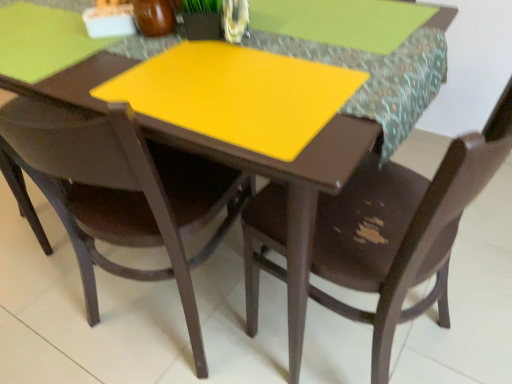
Question: From a real-world perspective, is matte brown chair at center, arranged as the first chair when viewed from the left, positioned over yellow matte placemat at center based on gravity?

Choices:
 (A) yes
 (B) no

Answer: (B)

Question: Is matte brown chair at center, arranged as the first chair when viewed from the left, closer to the viewer compared to yellow matte placemat at center?

Choices:
 (A) yes
 (B) no

Answer: (A)

Question: From the image's perspective, is matte brown chair at center, the second chair viewed from the right, below yellow matte placemat at center?

Choices:
 (A) no
 (B) yes

Answer: (B)

Question: Does matte brown chair at center, the second chair viewed from the right, have a greater width compared to yellow matte placemat at center?

Choices:
 (A) no
 (B) yes

Answer: (B)

Question: Does matte brown chair at center, arranged as the first chair when viewed from the left, have a greater height compared to yellow matte placemat at center?

Choices:
 (A) yes
 (B) no

Answer: (A)

Question: Is yellow matte placemat at center to the left or to the right of matte brown chair at center, arranged as the first chair when viewed from the left, in the image?

Choices:
 (A) left
 (B) right

Answer: (B)

Question: Is yellow matte placemat at center taller or shorter than matte brown chair at center, arranged as the first chair when viewed from the left?

Choices:
 (A) short
 (B) tall

Answer: (A)

Question: Do you think yellow matte placemat at center is within matte brown chair at center, the second chair viewed from the right, or outside of it?

Choices:
 (A) outside
 (B) inside

Answer: (A)

Question: Is yellow matte placemat at center in front of or behind matte brown chair at center, arranged as the first chair when viewed from the left, in the image?

Choices:
 (A) behind
 (B) front

Answer: (A)

Question: From a real-world perspective, relative to yellow matte placemat at center, is brown matte chair at center, acting as the 2th chair starting from the left, vertically above or below?

Choices:
 (A) below
 (B) above

Answer: (A)

Question: Is point (349, 269) closer or farther from the camera than point (371, 82)?

Choices:
 (A) farther
 (B) closer

Answer: (A)

Question: From the image's perspective, is brown matte chair at center, which is counted as the first chair, starting from the right, positioned above or below yellow matte placemat at center?

Choices:
 (A) above
 (B) below

Answer: (B)

Question: Relative to yellow matte placemat at center, is brown matte chair at center, which is counted as the first chair, starting from the right, in front or behind?

Choices:
 (A) behind
 (B) front

Answer: (B)

Question: In the image, is matte brown chair at center, the second chair viewed from the right, positioned in front of or behind brown matte chair at center, acting as the 2th chair starting from the left?

Choices:
 (A) front
 (B) behind

Answer: (B)

Question: From their relative heights in the image, would you say matte brown chair at center, the second chair viewed from the right, is taller or shorter than brown matte chair at center, which is counted as the first chair, starting from the right?

Choices:
 (A) tall
 (B) short

Answer: (B)